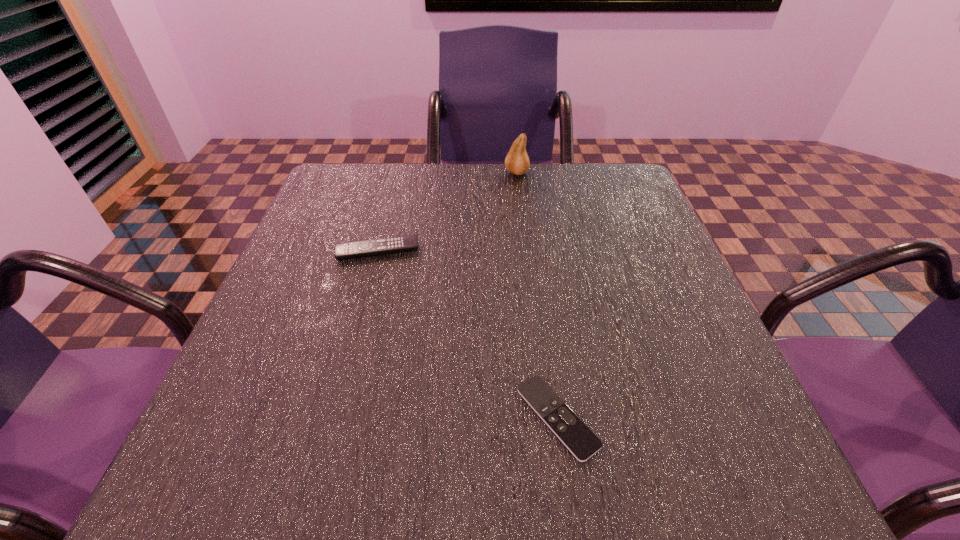
This screenshot has width=960, height=540. What are the coordinates of `object located in the near edge section of the desktop` in the screenshot? It's located at (566, 425).

Locate an element on the screen. This screenshot has width=960, height=540. object that is at the left edge is located at coordinates (355, 249).

At what (x,y) coordinates should I click in order to perform the action: click on vacant space at the far edge of the desktop. Please return your answer as a coordinate pair (x, y). This screenshot has width=960, height=540. Looking at the image, I should click on (540, 192).

Where is `free spot at the near edge of the desktop`? free spot at the near edge of the desktop is located at coordinates (504, 471).

Locate an element on the screen. The image size is (960, 540). vacant position at the left edge of the desktop is located at coordinates (216, 393).

At what (x,y) coordinates should I click in order to perform the action: click on free space at the right edge. Please return your answer as a coordinate pair (x, y). Looking at the image, I should click on (603, 239).

You are a GUI agent. You are given a task and a screenshot of the screen. Output one action in this format:
    pyautogui.click(x=<x>, y=<y>)
    Task: Click on the vacant space at the far left corner of the desktop
    The height and width of the screenshot is (540, 960).
    Given the screenshot: What is the action you would take?
    pyautogui.click(x=311, y=208)

In the image, there is a desktop. Where is `vacant area at the far right corner`? The width and height of the screenshot is (960, 540). vacant area at the far right corner is located at coordinates (620, 189).

Identify the location of empty location between the nearest object and the farthest object. The width and height of the screenshot is (960, 540). (537, 295).

You are a GUI agent. You are given a task and a screenshot of the screen. Output one action in this format:
    pyautogui.click(x=<x>, y=<y>)
    Task: Click on the empty space that is in between the farthest object and the leftmost object
    The width and height of the screenshot is (960, 540).
    Given the screenshot: What is the action you would take?
    pyautogui.click(x=447, y=212)